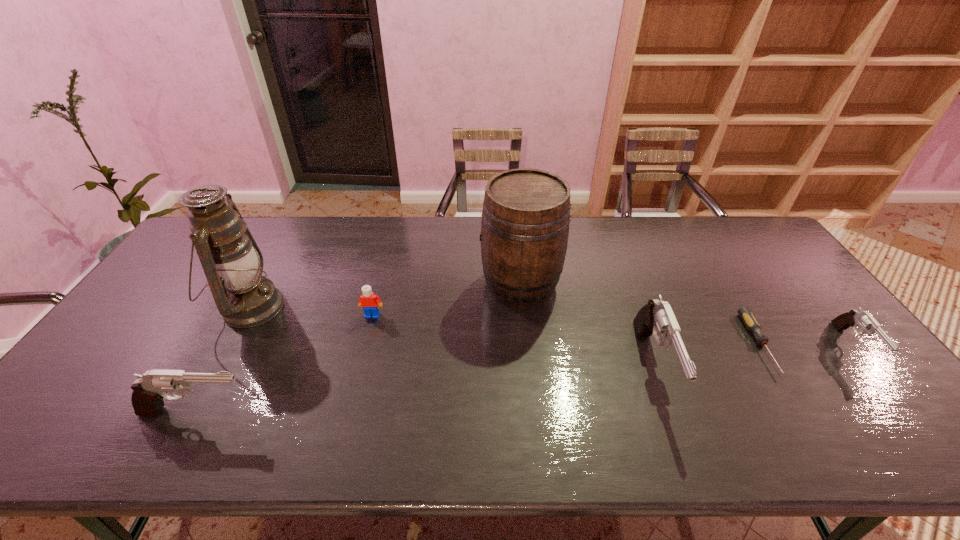
Locate an element on the screen. free space that satisfies the following two spatial constraints: 1. at the muzzle of the rightmost object; 2. at the muzzle of the fourth shortest object is located at coordinates (907, 412).